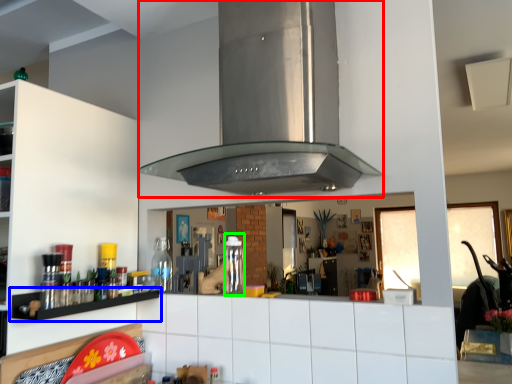
Question: Based on their relative distances, which object is farther from vent (highlighted by a red box)? Choose from shelf (highlighted by a blue box) and bottle (highlighted by a green box).

Choices:
 (A) shelf
 (B) bottle

Answer: (A)